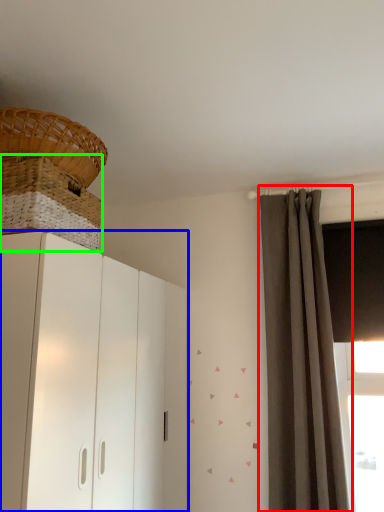
Question: Which is farther away from curtain (highlighted by a red box)? cupboard (highlighted by a blue box) or basket (highlighted by a green box)?

Choices:
 (A) cupboard
 (B) basket

Answer: (B)